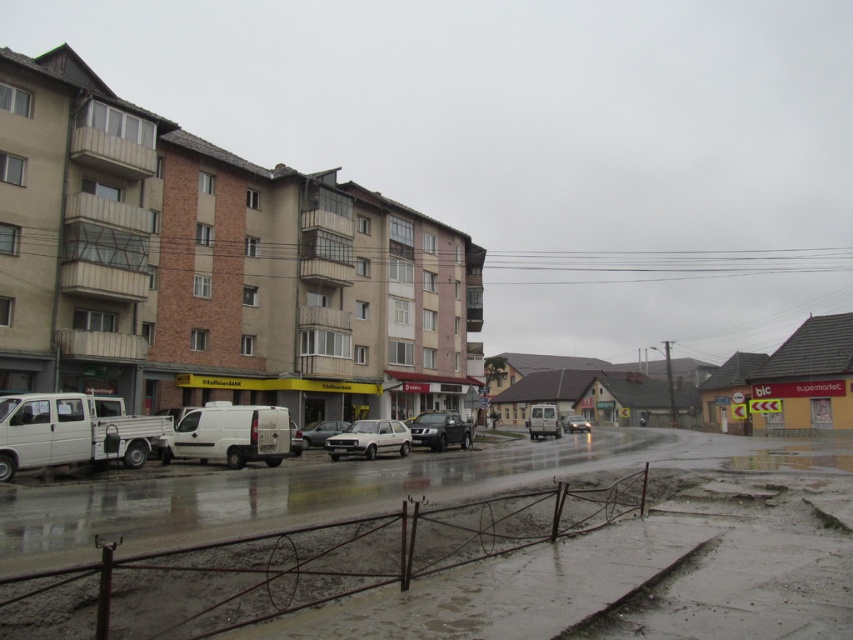
Which is behind, point (540, 429) or point (576, 426)?

Point (576, 426)

Is matte white van at center closer to camera compared to silver metallic sedan at center?

Yes, it is in front of silver metallic sedan at center.

Where is `matte white van at center`? The width and height of the screenshot is (853, 640). matte white van at center is located at coordinates (543, 420).

From the picture: Is white matte van at center above silver metallic car at center?

Yes.

This screenshot has height=640, width=853. Find the location of `white matte van at center`. white matte van at center is located at coordinates (229, 435).

Who is more forward, [138,440] or [392,422]?

Point [138,440] is in front.

Who is more distant from viewer, (x=126, y=442) or (x=341, y=448)?

Point (x=341, y=448)

At what (x,y) coordinates should I click in order to perform the action: click on white matte van at left. Please return your answer as a coordinate pair (x, y). The image size is (853, 640). Looking at the image, I should click on (71, 432).